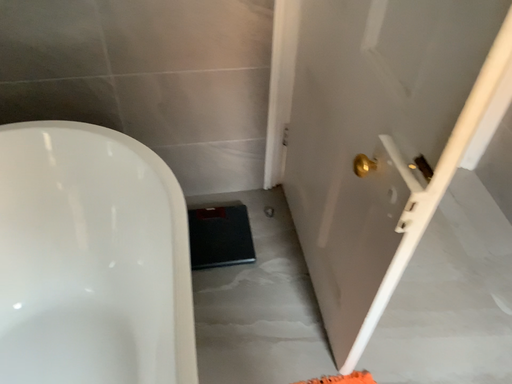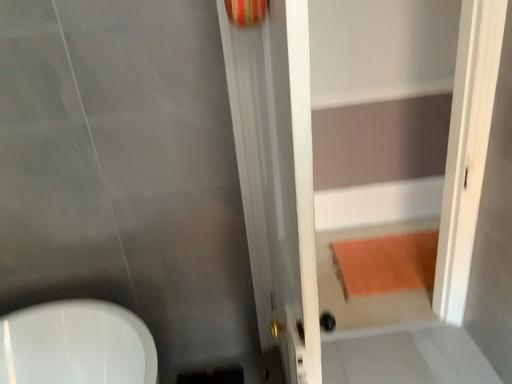
Question: Which way did the camera rotate in the video?

Choices:
 (A) rotated downward
 (B) rotated upward

Answer: (B)